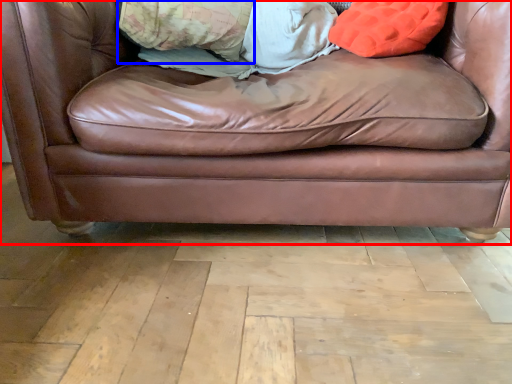
Question: Which object is further to the camera taking this photo, studio couch (highlighted by a red box) or pillow (highlighted by a blue box)?

Choices:
 (A) studio couch
 (B) pillow

Answer: (B)